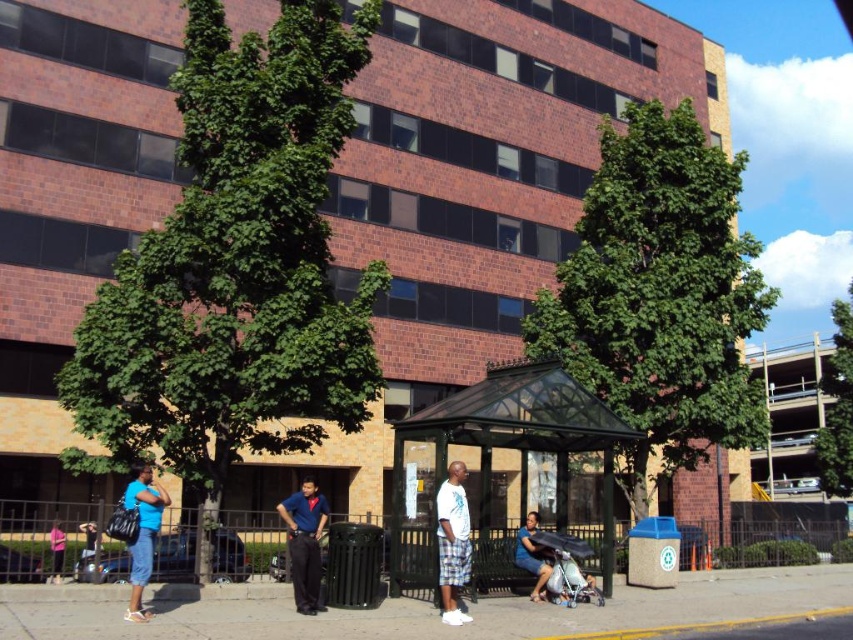
Question: Based on their relative distances, which object is farther from the dark blue jeans at lower left?

Choices:
 (A) white cotton shirt at center
 (B) green leafy tree at center

Answer: (B)

Question: Which of these objects is positioned closest to the blue denim shorts at lower left?

Choices:
 (A) white cotton shirt at center
 (B) green transparent bus stop at center
 (C) green leafy tree at center

Answer: (A)

Question: Which point is farther to the camera?

Choices:
 (A) dark blue jeans at lower left
 (B) blue denim shorts at lower left

Answer: (B)

Question: Does white cotton shirt at center have a smaller size compared to blue denim shorts at lower left?

Choices:
 (A) yes
 (B) no

Answer: (A)

Question: Considering the relative positions of green leafy tree at center and dark blue jeans at lower left in the image provided, where is green leafy tree at center located with respect to dark blue jeans at lower left?

Choices:
 (A) left
 (B) right

Answer: (B)

Question: Does green transparent bus stop at center have a smaller size compared to dark blue shirt at center?

Choices:
 (A) no
 (B) yes

Answer: (A)